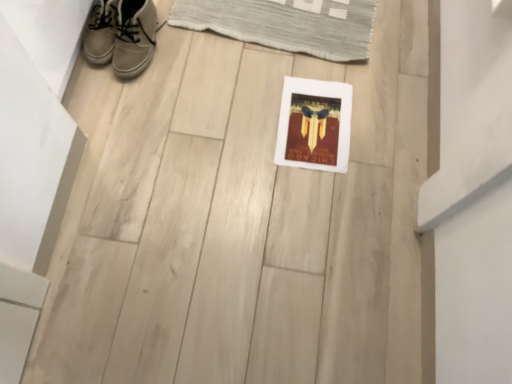
The image size is (512, 384). I want to click on vacant area to the right of white matte picture frame at center, so click(389, 130).